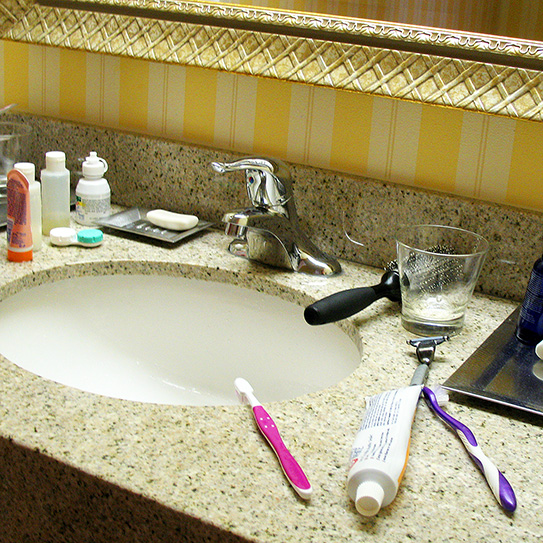
Identify the location of handle that you push up for water to run. This screenshot has height=543, width=543. (238, 165).